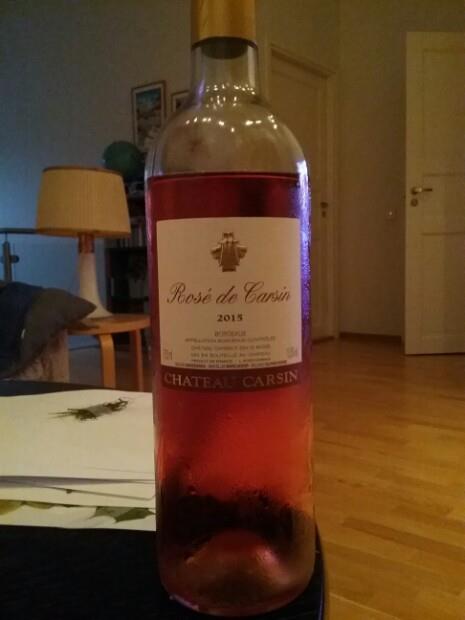
The width and height of the screenshot is (465, 620). Identify the location of bookcase. coord(139,234), coord(123,265), coord(139,299).